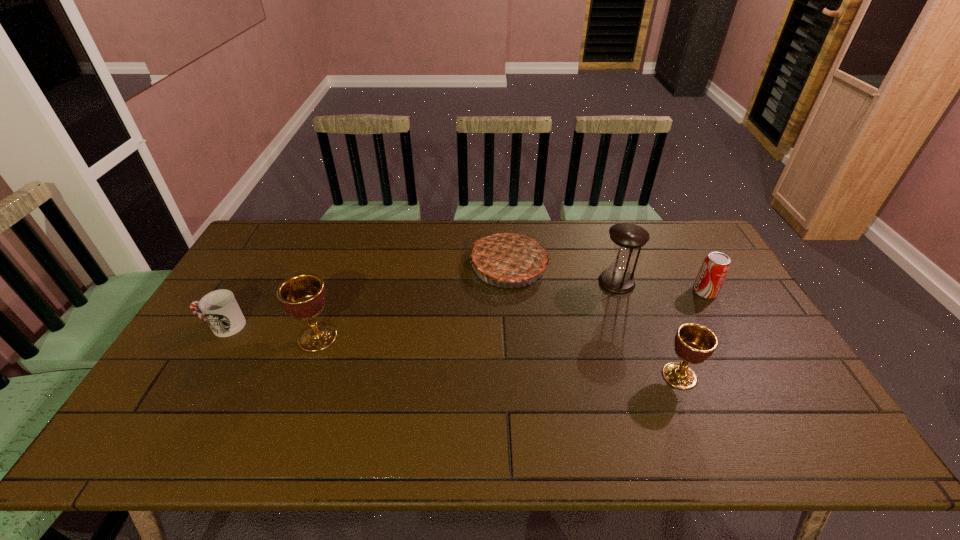
This screenshot has height=540, width=960. Identify the location of free point at the right edge. (724, 292).

The height and width of the screenshot is (540, 960). Identify the location of free space at the far left corner. [x=265, y=245].

In the image, there is a desktop. At what (x,y) coordinates should I click in order to perform the action: click on vacant space at the near left corner. Please return your answer as a coordinate pair (x, y). This screenshot has width=960, height=540. Looking at the image, I should click on (172, 406).

This screenshot has width=960, height=540. In the image, there is a desktop. What are the coordinates of `vacant region at the far right corner` in the screenshot? It's located at (686, 233).

Locate an element on the screen. Image resolution: width=960 pixels, height=540 pixels. free space that is in between the left chalice and the pie is located at coordinates (413, 301).

The image size is (960, 540). I want to click on vacant point located between the farther chalice and the fourth object from right to left, so click(413, 301).

What are the coordinates of `empty location between the shorter chalice and the cup` in the screenshot? It's located at (451, 351).

In order to click on vacant area between the hourglass and the nearest object in this screenshot , I will do `click(648, 329)`.

I want to click on vacant area between the third object from left to right and the taller chalice, so (413, 301).

In order to click on vacant point located between the fifth object from right to left and the nearer chalice in this screenshot , I will do `click(498, 356)`.